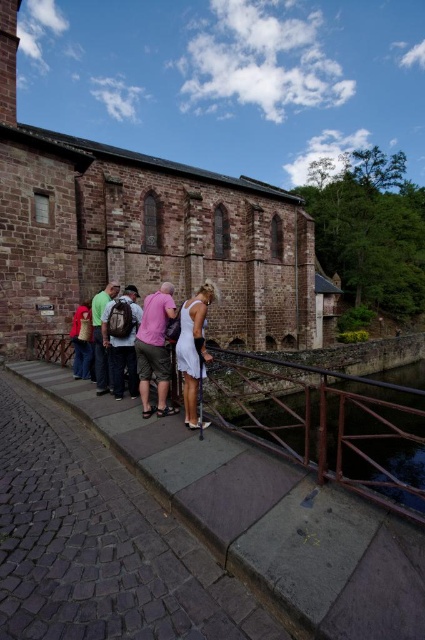
You are standing on the cobblestone pathway next to the stone bridge. There is a point marked at coordinates (141, 230). What does this point represent in the scene?

The point at coordinates (141, 230) represents the brown stone church at center.

You are standing on the cobblestone pathway near the stone bridge and want to lean on the rusty metal railing at center. However, there is a person wearing a red cotton shirt at lower left in your way. Based on their positions, can you reach the railing without moving the person?

The rusty metal railing at center is positioned under the red cotton shirt at lower left, meaning the person is blocking direct access to the railing. You would need to move around them to reach it.

You are standing on the cobblestone pathway next to the stone bridge and want to reach the point marked at coordinates point (289, 340). Given that you can walk 100 feet per minute, how many minutes will it take you to reach that point?

The distance between you and the point (289, 340) is 260.32 feet. At a walking speed of 100 feet per minute, it will take approximately 2.6 minutes to reach the point.